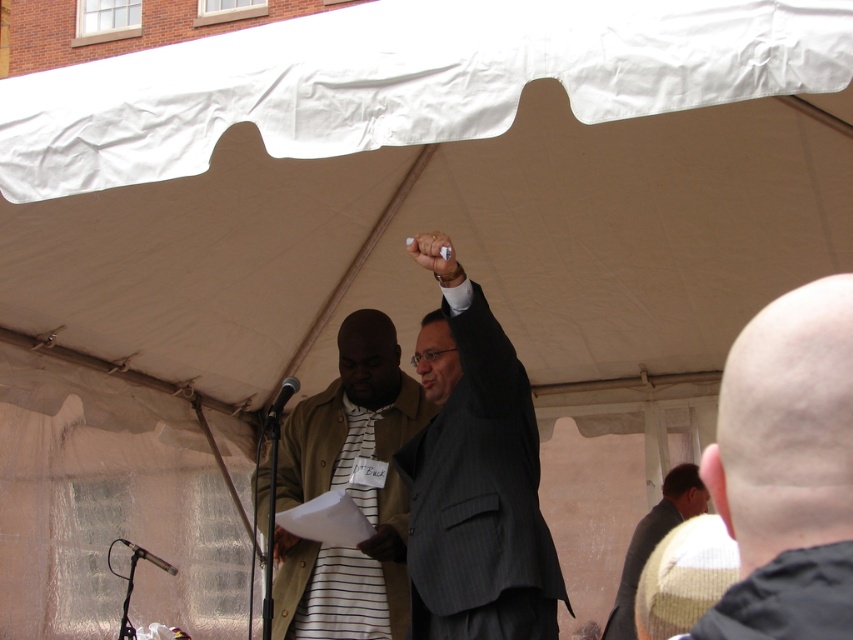
Question: Which object is closer to the camera taking this photo?

Choices:
 (A) black metallic microphone at center
 (B) white matte pen at upper center
 (C) silver metallic microphone at lower left

Answer: (B)

Question: Which is nearer to the white matte pen at upper center?

Choices:
 (A) dark gray suit at lower right
 (B) black fabric at lower right
 (C) silver metallic microphone at lower left

Answer: (B)

Question: Which object is the farthest from the pinstriped suit at center?

Choices:
 (A) bald head at upper right
 (B) silver metallic microphone at lower left
 (C) striped fabric shirt at center
 (D) black fabric at lower right

Answer: (D)

Question: Observing the image, what is the correct spatial positioning of pinstriped suit at center in reference to dark gray suit at lower right?

Choices:
 (A) above
 (B) below

Answer: (A)

Question: Is the position of dark gray suit at lower right more distant than that of black metallic microphone at center?

Choices:
 (A) no
 (B) yes

Answer: (A)

Question: Is pinstriped suit at center wider than white matte pen at upper center?

Choices:
 (A) no
 (B) yes

Answer: (B)